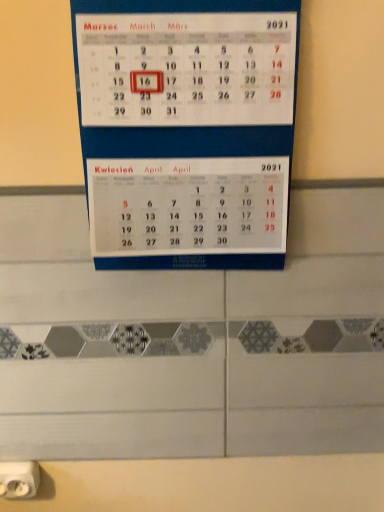
Question: From the image's perspective, is white paper calendar at center on top of white plastic power plugs and sockets at lower left?

Choices:
 (A) yes
 (B) no

Answer: (A)

Question: Considering the relative sizes of white paper calendar at center and white plastic power plugs and sockets at lower left in the image provided, is white paper calendar at center thinner than white plastic power plugs and sockets at lower left?

Choices:
 (A) yes
 (B) no

Answer: (B)

Question: Considering the relative sizes of white paper calendar at center and white plastic power plugs and sockets at lower left in the image provided, is white paper calendar at center taller than white plastic power plugs and sockets at lower left?

Choices:
 (A) yes
 (B) no

Answer: (A)

Question: Is white paper calendar at center turned away from white plastic power plugs and sockets at lower left?

Choices:
 (A) no
 (B) yes

Answer: (A)

Question: Is white paper calendar at center not close to white plastic power plugs and sockets at lower left?

Choices:
 (A) yes
 (B) no

Answer: (B)

Question: Is white paper calendar at center aimed at white plastic power plugs and sockets at lower left?

Choices:
 (A) yes
 (B) no

Answer: (B)

Question: Is white plastic power plugs and sockets at lower left closer to the viewer compared to white paper calendar at center?

Choices:
 (A) yes
 (B) no

Answer: (B)

Question: Is white plastic power plugs and sockets at lower left wider than white paper calendar at center?

Choices:
 (A) yes
 (B) no

Answer: (B)

Question: From a real-world perspective, is white plastic power plugs and sockets at lower left located higher than white paper calendar at center?

Choices:
 (A) yes
 (B) no

Answer: (B)

Question: Would you say white paper calendar at center is part of white plastic power plugs and sockets at lower left's contents?

Choices:
 (A) no
 (B) yes

Answer: (A)

Question: Does white plastic power plugs and sockets at lower left have a larger size compared to white paper calendar at center?

Choices:
 (A) yes
 (B) no

Answer: (B)

Question: Considering the relative sizes of white plastic power plugs and sockets at lower left and white paper calendar at center in the image provided, is white plastic power plugs and sockets at lower left thinner than white paper calendar at center?

Choices:
 (A) yes
 (B) no

Answer: (A)

Question: Considering the positions of white plastic power plugs and sockets at lower left and white paper calendar at center in the image, is white plastic power plugs and sockets at lower left wider or thinner than white paper calendar at center?

Choices:
 (A) wide
 (B) thin

Answer: (B)